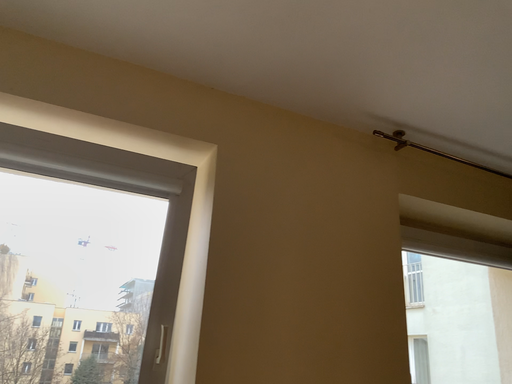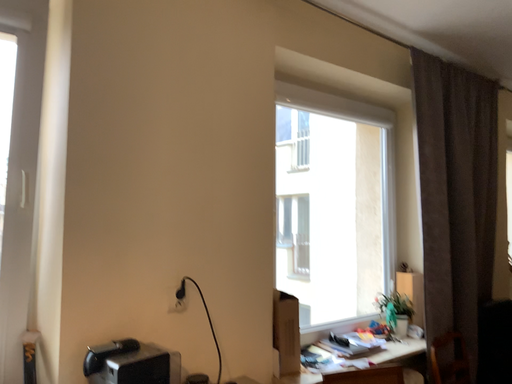
Question: Which way did the camera rotate in the video?

Choices:
 (A) rotated left
 (B) rotated right

Answer: (B)